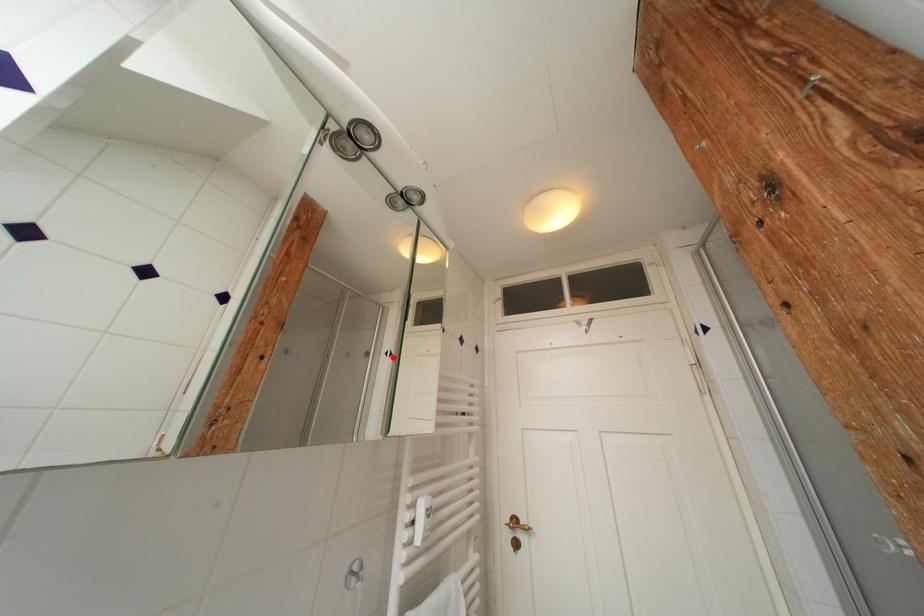
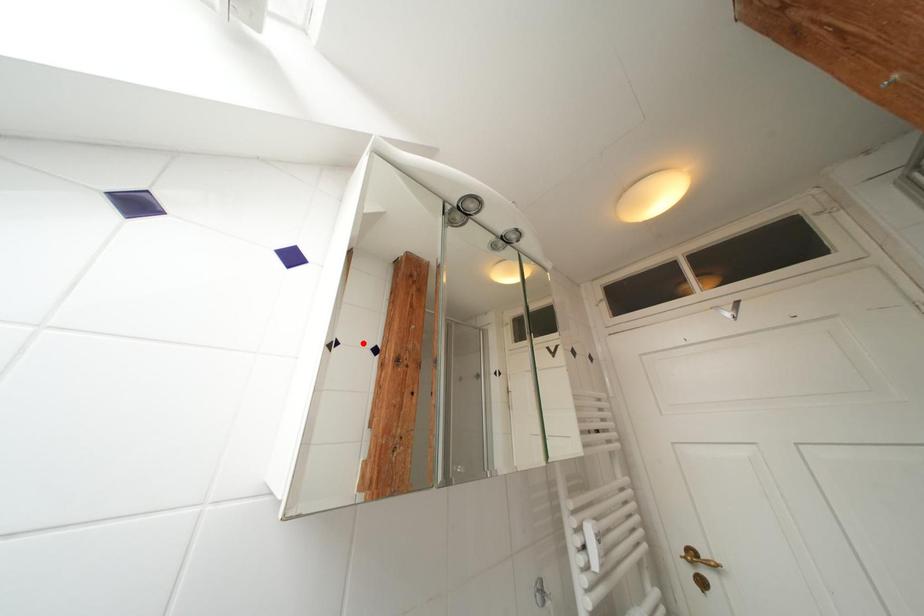
I am providing you with two images of the same scene from different viewpoints. A red point is marked on the first image and another point is marked on the second image. Is the marked point in image1 the same physical position as the marked point in image2?

No